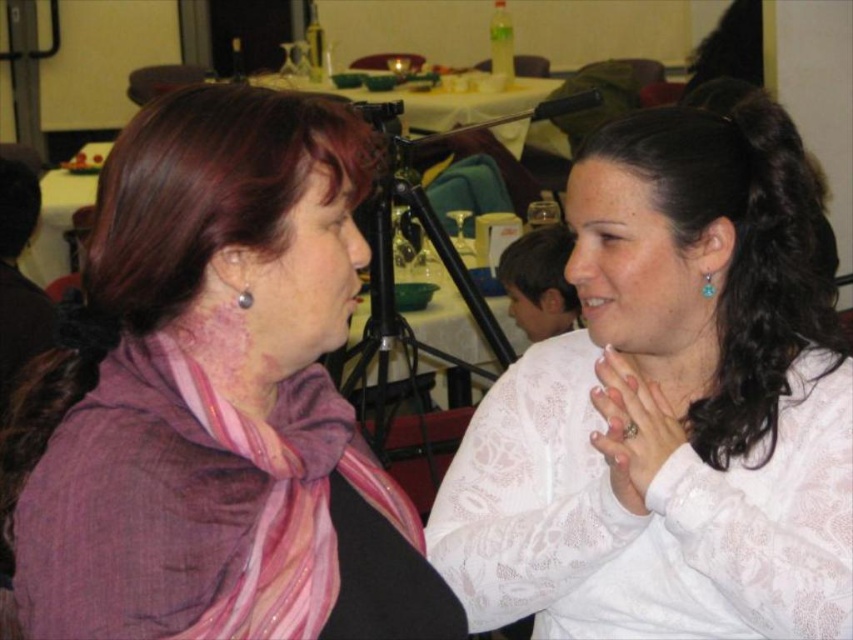
Question: Which of the following is the closest to the observer?

Choices:
 (A) white lace hand at center
 (B) purple scarf at left
 (C) matte pink scarf at upper left

Answer: (B)

Question: Is teal earrings at right closer to the viewer compared to smooth skin face at center?

Choices:
 (A) yes
 (B) no

Answer: (A)

Question: Can you confirm if smooth skin face at center is positioned to the left of silver metallic earring at upper left?

Choices:
 (A) yes
 (B) no

Answer: (B)

Question: Observing the image, what is the correct spatial positioning of purple scarf at left in reference to teal earrings at right?

Choices:
 (A) below
 (B) above

Answer: (A)

Question: Estimate the real-world distances between objects in this image. Which object is farther from the white lace blouse at center?

Choices:
 (A) white lace hand at center
 (B) silver metallic earring at upper left
 (C) smooth skin face at center

Answer: (C)

Question: Which of the following is the farthest from the observer?

Choices:
 (A) (668, 428)
 (B) (662, 196)
 (C) (109, 173)
 (D) (316, 340)

Answer: (B)